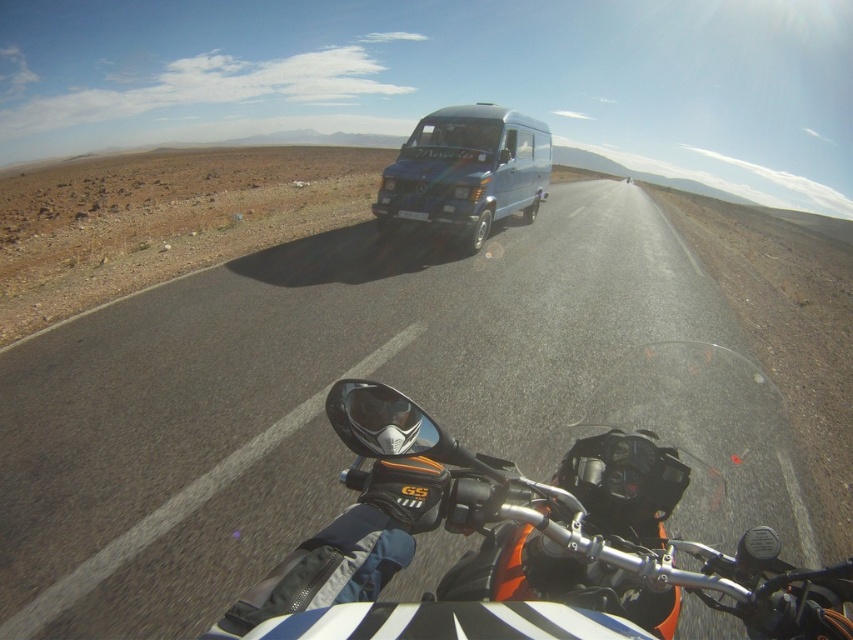
Question: Is asphalt road at center to the right of orange matte motorcycle at center from the viewer's perspective?

Choices:
 (A) no
 (B) yes

Answer: (B)

Question: Based on their relative distances, which object is farther from the orange matte motorcycle at center?

Choices:
 (A) asphalt road at center
 (B) blue metallic van at center

Answer: (B)

Question: Does asphalt road at center appear over orange matte motorcycle at center?

Choices:
 (A) yes
 (B) no

Answer: (A)

Question: Estimate the real-world distances between objects in this image. Which object is closer to the asphalt road at center?

Choices:
 (A) blue metallic van at center
 (B) orange matte motorcycle at center

Answer: (A)

Question: Can you confirm if asphalt road at center is positioned below orange matte motorcycle at center?

Choices:
 (A) yes
 (B) no

Answer: (B)

Question: Which is nearer to the orange matte motorcycle at center?

Choices:
 (A) blue metallic van at center
 (B) asphalt road at center

Answer: (B)